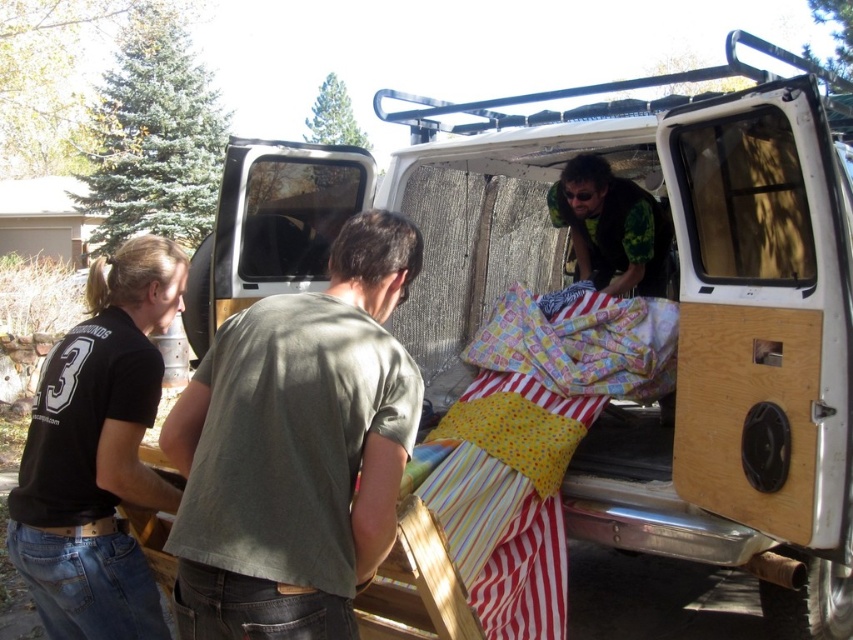
You are trying to determine if the white wood van at center can fit through a narrow alley that is only as wide as the black cotton shirt at left. Based on the scene, can you confirm if the van is wider than the shirt?

The white wood van at center might be wider than the black cotton shirt at left, so it may not fit through the alley if the alley is only as wide as the shirt.

You are organizing a clothing donation drive and need to sort shirts by size. You have a green cotton shirt at center and a black cotton shirt at left. Which shirt should you place in the large size bin?

The green cotton shirt at center should be placed in the large size bin because its width is larger than the black cotton shirt at left.